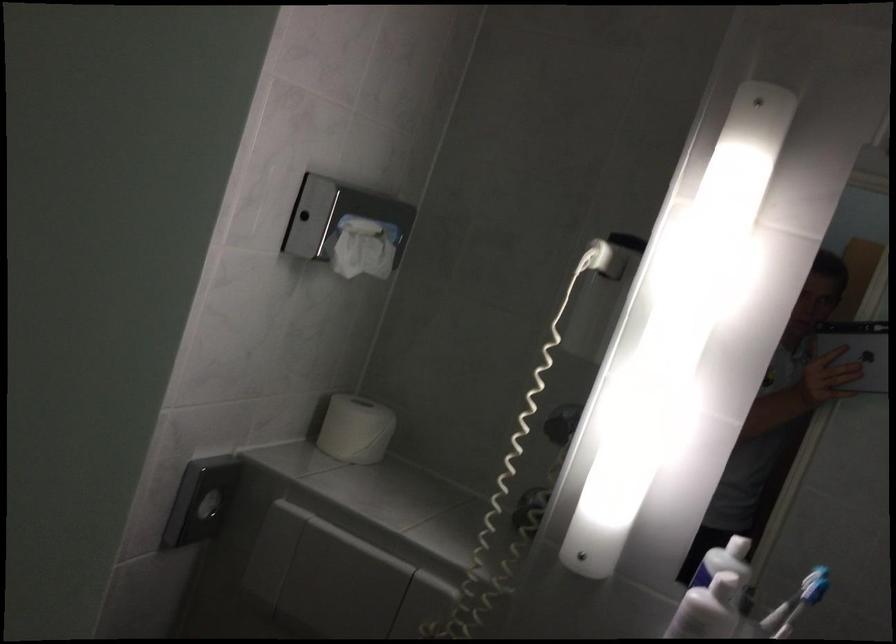
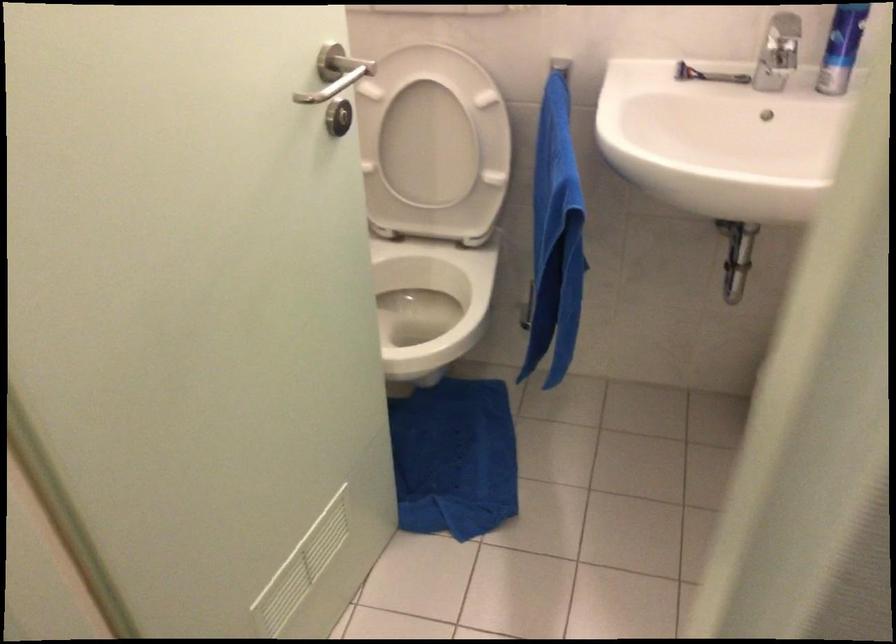
Question: The images are taken continuously from a first-person perspective. In which direction is your viewpoint rotating?

Choices:
 (A) Left
 (B) Right
 (C) Up
 (D) Down

Answer: (D)